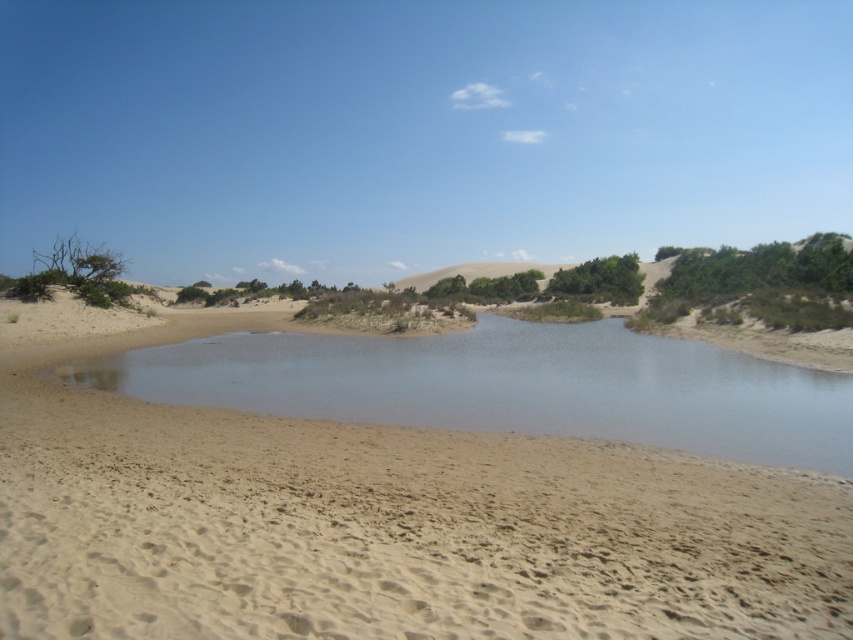
Can you confirm if light brown sandy beach at center is smaller than clear water at center?

Incorrect, light brown sandy beach at center is not smaller in size than clear water at center.

The height and width of the screenshot is (640, 853). Describe the element at coordinates (374, 516) in the screenshot. I see `light brown sandy beach at center` at that location.

Who is more forward, (39,397) or (662,428)?

Point (662,428)

At what (x,y) coordinates should I click in order to perform the action: click on light brown sandy beach at center. Please return your answer as a coordinate pair (x, y). Image resolution: width=853 pixels, height=640 pixels. Looking at the image, I should click on (374, 516).